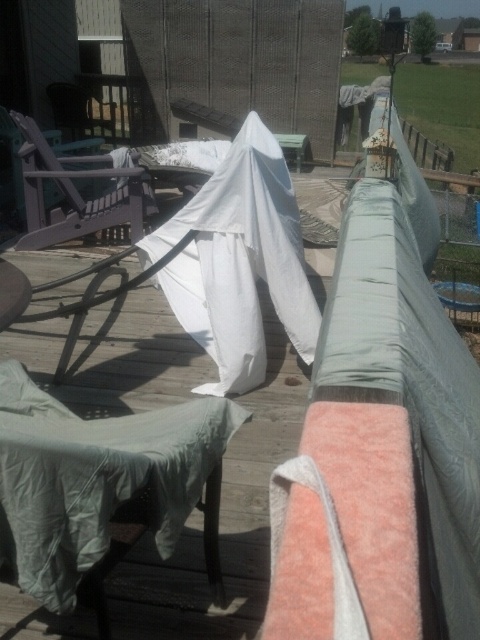
Question: Can you confirm if green fabric chair at lower left is positioned to the left of matte purple chair at left?

Choices:
 (A) no
 (B) yes

Answer: (A)

Question: Can you confirm if green fabric chair at lower left is thinner than matte purple chair at left?

Choices:
 (A) yes
 (B) no

Answer: (A)

Question: Which of the following is the farthest from the observer?

Choices:
 (A) matte purple chair at left
 (B) green fabric chair at lower left
 (C) white fabric ghost at center

Answer: (A)

Question: In this image, where is green fabric chair at lower left located relative to matte purple chair at left?

Choices:
 (A) above
 (B) below

Answer: (B)

Question: Which point appears farthest from the camera in this image?

Choices:
 (A) (194, 218)
 (B) (25, 500)

Answer: (A)

Question: Which object appears closest to the camera in this image?

Choices:
 (A) white fabric ghost at center
 (B) green fabric chair at lower left

Answer: (B)